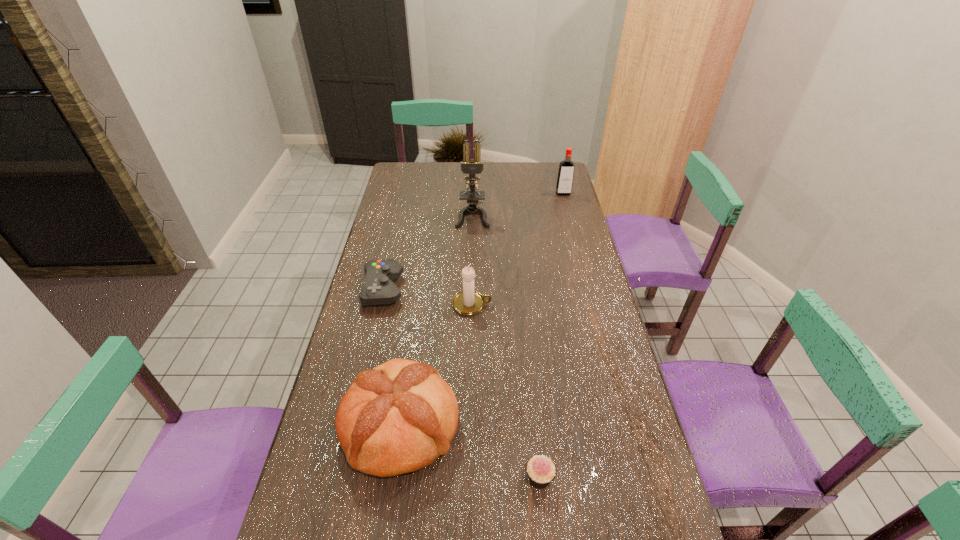
The image size is (960, 540). I want to click on vacant space that satisfies the following two spatial constraints: 1. on the front and back of the vodka; 2. on the handle side of the candle holder, so click(x=592, y=305).

You are a GUI agent. You are given a task and a screenshot of the screen. Output one action in this format:
    pyautogui.click(x=<x>, y=<y>)
    Task: Click on the vacant space that satisfies the following two spatial constraints: 1. on the front side of the control; 2. on the right side of the bread
    
    Given the screenshot: What is the action you would take?
    pyautogui.click(x=351, y=425)

This screenshot has height=540, width=960. Find the location of `vacant region that satisfies the following two spatial constraints: 1. on the front and back of the rightmost object; 2. on the handle side of the candle holder`. vacant region that satisfies the following two spatial constraints: 1. on the front and back of the rightmost object; 2. on the handle side of the candle holder is located at coordinates (592, 305).